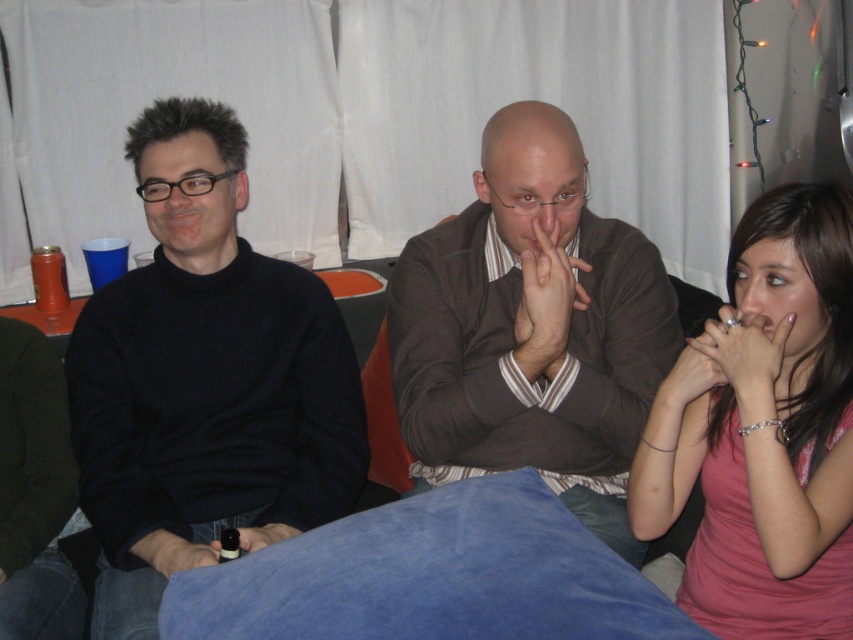
Who is higher up, black turtleneck sweater at left or brown sweater at center?

brown sweater at center is above.

Is black turtleneck sweater at left to the left of brown sweater at center from the viewer's perspective?

Indeed, black turtleneck sweater at left is positioned on the left side of brown sweater at center.

Locate an element on the screen. black turtleneck sweater at left is located at coordinates (204, 380).

Where is `black turtleneck sweater at left`? This screenshot has height=640, width=853. black turtleneck sweater at left is located at coordinates (204, 380).

Can you confirm if black turtleneck sweater at left is taller than pink fabric shirt at right?

Yes.

Measure the distance between black turtleneck sweater at left and pink fabric shirt at right.

The distance of black turtleneck sweater at left from pink fabric shirt at right is 26.67 inches.

Does point (148, 493) lie in front of point (685, 356)?

No, it is not.

Find the location of a particular element. The image size is (853, 640). black turtleneck sweater at left is located at coordinates (204, 380).

Can you confirm if brown sweater at center is bigger than pink fabric shirt at right?

Correct, brown sweater at center is larger in size than pink fabric shirt at right.

Can you confirm if brown sweater at center is taller than pink fabric shirt at right?

Yes, brown sweater at center is taller than pink fabric shirt at right.

Does point (410, 291) come behind point (838, 301)?

Yes, point (410, 291) is behind point (838, 301).

Locate an element on the screen. The image size is (853, 640). brown sweater at center is located at coordinates (531, 330).